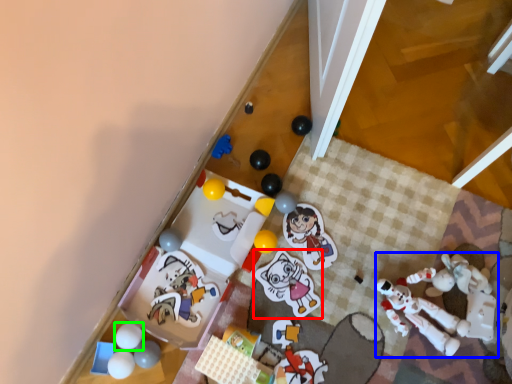
Question: Which is nearer to the toy (highlighted by a red box)? toy (highlighted by a blue box) or toy (highlighted by a green box).

Choices:
 (A) toy
 (B) toy

Answer: (A)